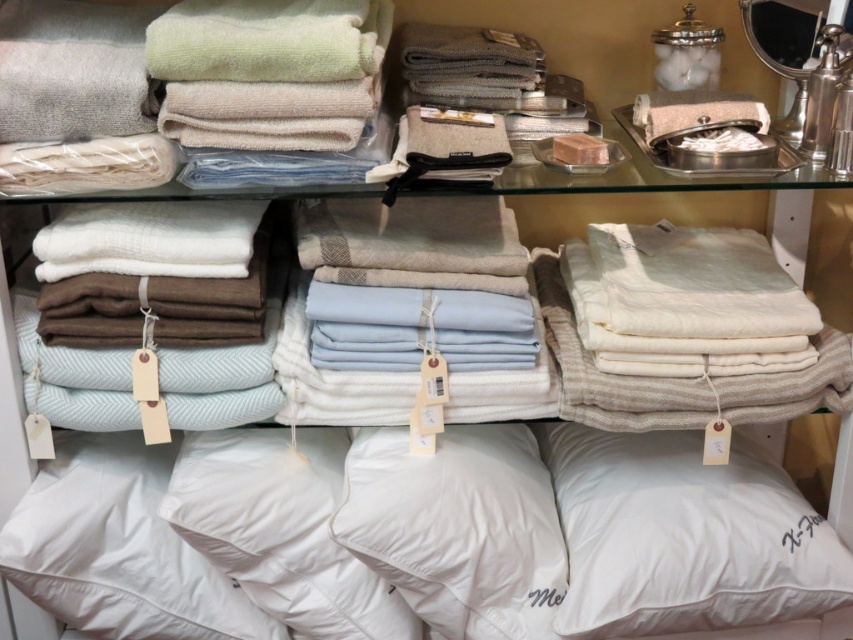
Based on the photo, can you confirm if white soft pillow at lower right is positioned below white down pillow at center?

→ Incorrect, white soft pillow at lower right is not positioned below white down pillow at center.

Does point (654, 589) come farther from viewer compared to point (422, 609)?

No, (654, 589) is in front of (422, 609).

Identify the location of white soft pillow at lower right. (683, 536).

Can you confirm if white down pillow at center is shorter than white down-filled pillow at lower center?

Yes, white down pillow at center is shorter than white down-filled pillow at lower center.

Between white down pillow at center and white down-filled pillow at lower center, which one is positioned higher?

Positioned higher is white down pillow at center.

Who is more distant from viewer, (451, 550) or (260, 586)?

Point (260, 586)

The image size is (853, 640). Find the location of `white down pillow at center`. white down pillow at center is located at coordinates (457, 529).

Find the location of a particular element. white down pillow at center is located at coordinates coord(457,529).

Between point (538, 464) and point (189, 618), which one is positioned behind?

The point (538, 464) is behind.

Who is more distant from viewer, (514, 618) or (71, 486)?

Point (514, 618)

Identify the location of white down pillow at center. The width and height of the screenshot is (853, 640). (457, 529).